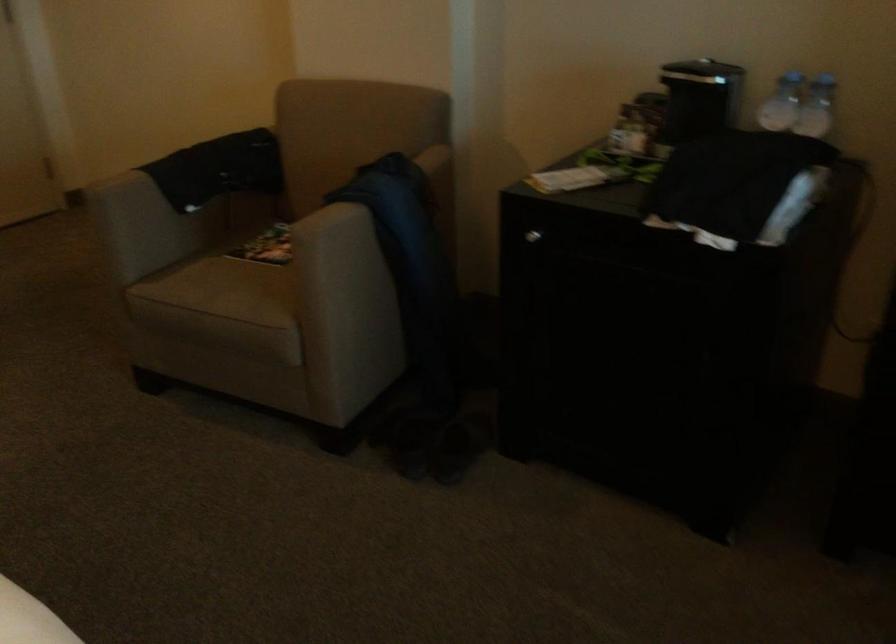
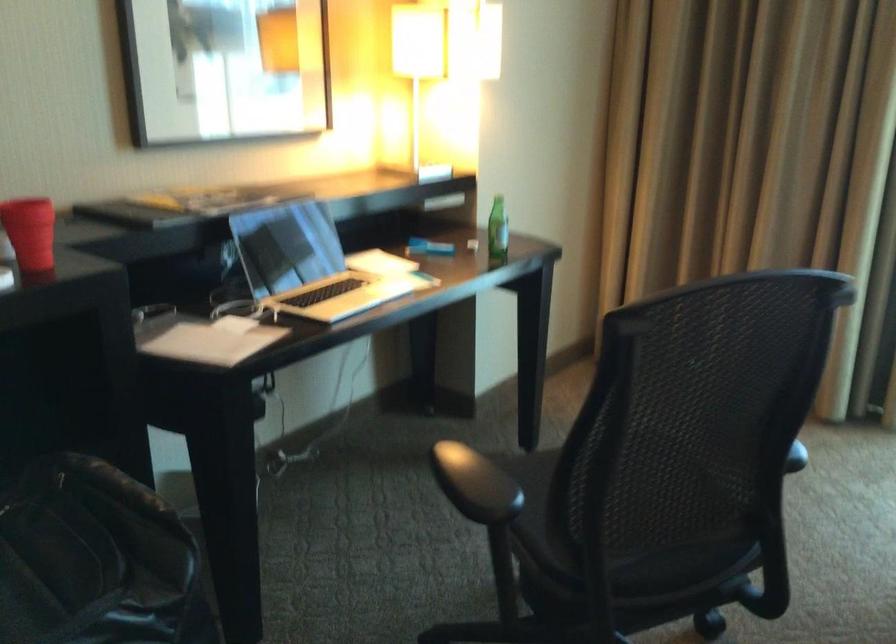
Question: The images are taken continuously from a first-person perspective. In which direction is your viewpoint rotating?

Choices:
 (A) Left
 (B) Right
 (C) Up
 (D) Down

Answer: (B)